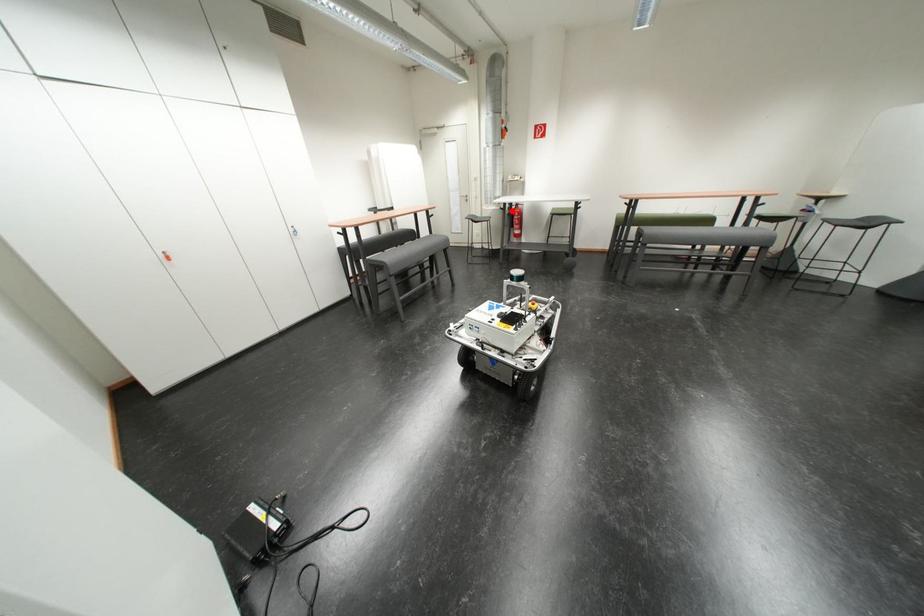
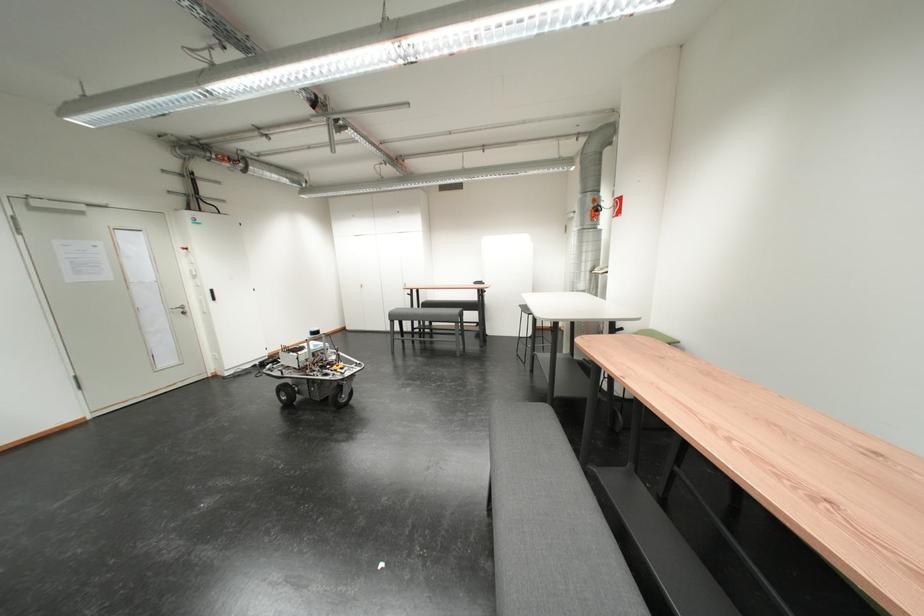
Question: I am providing you with two images of the same scene from different viewpoints. A red point is marked on the first image. Can you still see the location of the red point in image 2?

Choices:
 (A) Yes
 (B) No

Answer: (B)